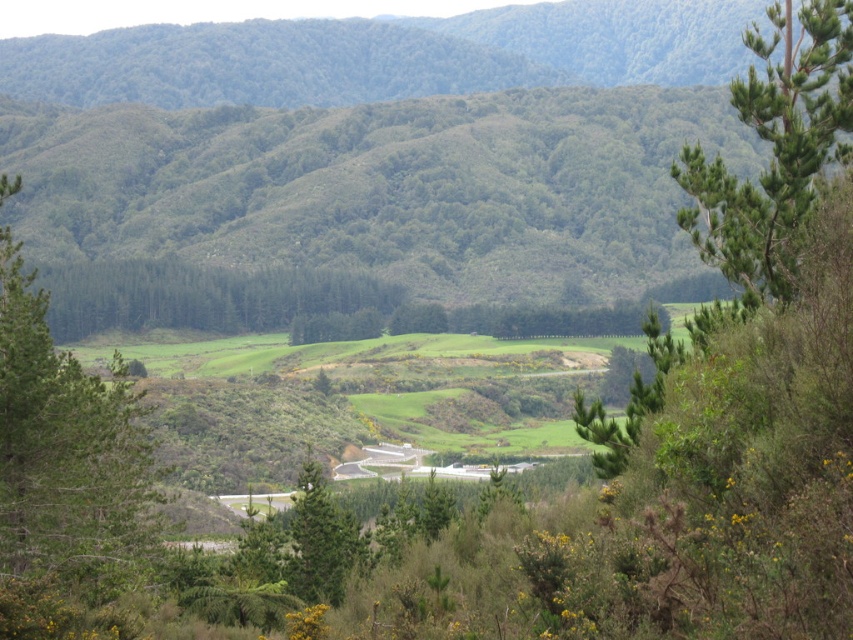
Question: Which of the following is the closest to the observer?

Choices:
 (A) green leafy forest at center
 (B) green needle-like at upper right
 (C) green textured tree at center
 (D) green matte forest at center

Answer: (B)

Question: Which of the following is the farthest from the observer?

Choices:
 (A) (252, 285)
 (B) (431, 131)
 (C) (45, 342)

Answer: (B)

Question: Is green needle-like at upper right positioned before green matte forest at center?

Choices:
 (A) yes
 (B) no

Answer: (A)

Question: Is green leafy forest at center above green needle-like at upper right?

Choices:
 (A) no
 (B) yes

Answer: (B)

Question: Does green needle-like at upper right appear on the right side of green textured tree at center?

Choices:
 (A) no
 (B) yes

Answer: (B)

Question: Among these objects, which one is nearest to the camera?

Choices:
 (A) green leafy tree at left
 (B) green needle-like at upper right
 (C) green matte forest at center
 (D) green leafy forest at center

Answer: (A)